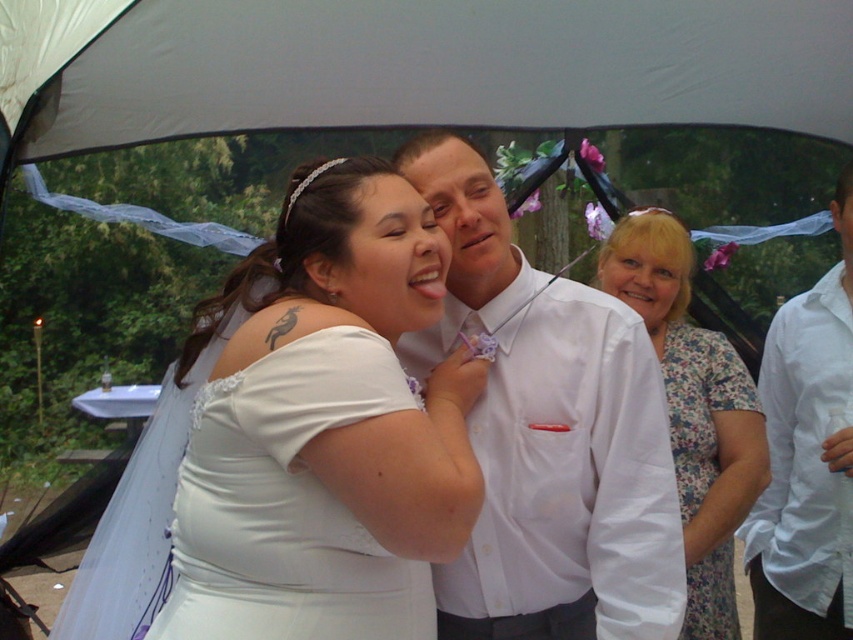
Question: Is white fabric canopy at upper center above floral dress at center?

Choices:
 (A) yes
 (B) no

Answer: (A)

Question: Does white glossy shirt at center have a lesser width compared to white cotton shirt at right?

Choices:
 (A) no
 (B) yes

Answer: (A)

Question: Based on their relative distances, which object is farther from the white satin dress at center?

Choices:
 (A) white glossy shirt at center
 (B) white cotton shirt at right
 (C) white fabric canopy at upper center

Answer: (B)

Question: Among these points, which one is farthest from the camera?

Choices:
 (A) (645, 440)
 (B) (817, 356)

Answer: (B)

Question: Based on their relative distances, which object is farther from the white satin dress at center?

Choices:
 (A) floral print dress at center
 (B) floral dress at center
 (C) white glossy shirt at center

Answer: (B)

Question: Does white fabric canopy at upper center appear under floral print dress at center?

Choices:
 (A) yes
 (B) no

Answer: (B)